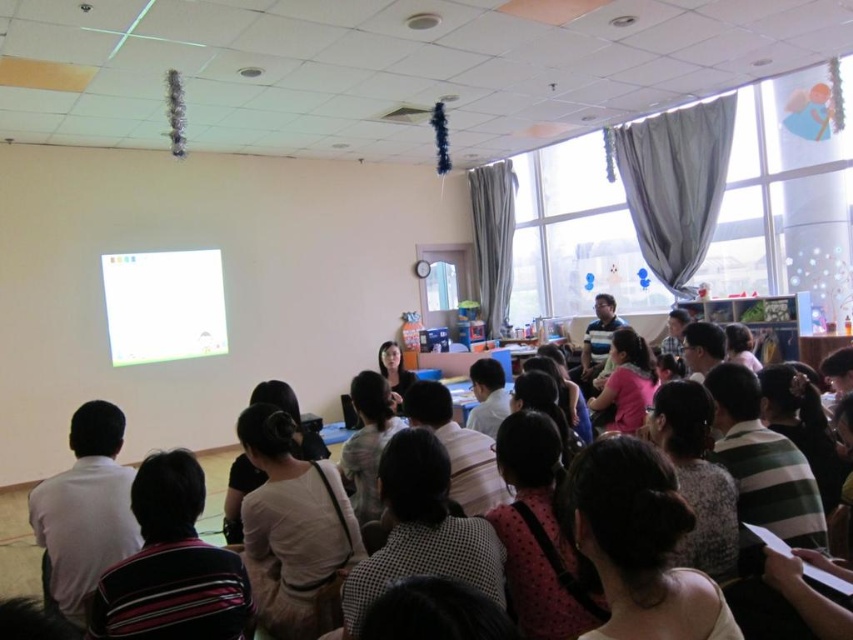
Question: Can you confirm if white shirt at center is positioned to the right of white glossy projector screen at upper left?

Choices:
 (A) no
 (B) yes

Answer: (B)

Question: Can you confirm if white shirt at center is bigger than white glossy projector screen at upper left?

Choices:
 (A) yes
 (B) no

Answer: (B)

Question: Among these objects, which one is farthest from the camera?

Choices:
 (A) white glossy projector screen at upper left
 (B) white shirt at center

Answer: (A)

Question: Considering the relative positions of white shirt at center and white glossy projector screen at upper left in the image provided, where is white shirt at center located with respect to white glossy projector screen at upper left?

Choices:
 (A) above
 (B) below

Answer: (B)

Question: Which point is closer to the camera?

Choices:
 (A) white glossy projector screen at upper left
 (B) white shirt at center

Answer: (B)